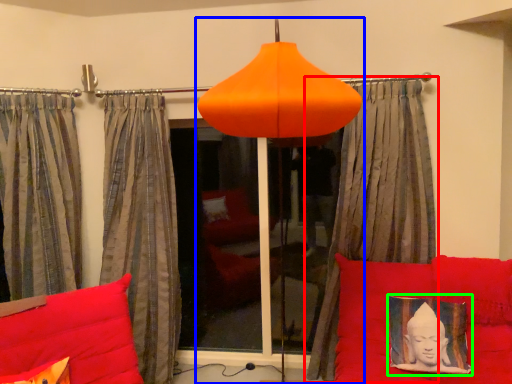
Question: Which is nearer to the curtain (highlighted by a red box)? lamp (highlighted by a blue box) or picture frame (highlighted by a green box).

Choices:
 (A) lamp
 (B) picture frame

Answer: (B)